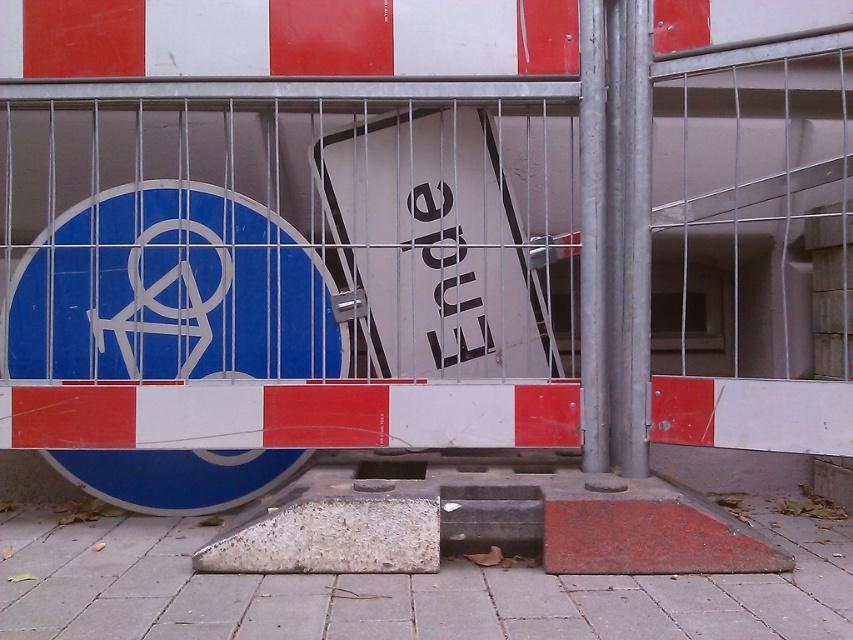
You are standing at point A at point (576,620) and want to walk to point B. The distance between them is 9.20 feet. Can you walk directly from point A to point B without crossing any barricades?

Yes, you can walk directly from point A at point (576,620) to point B without crossing any barricades since the distance between them is 9.20 feet.

You are standing at the origin point of the coordinate system in the image. You need to walk to the concrete pavement at center. In which direction should you move relative to your current position?

The concrete pavement at center is located at coordinate point 0.902 in the x direction and 0.487 in the y direction. Since you are at the origin, you should move in the positive x and positive y directions to reach it.